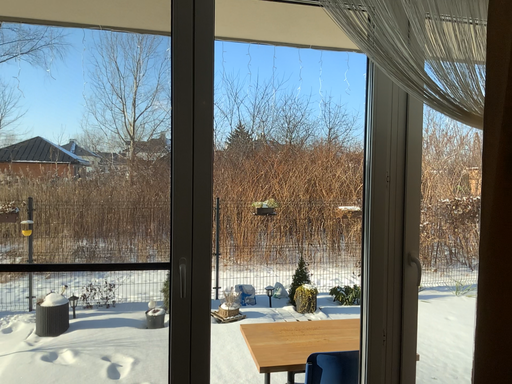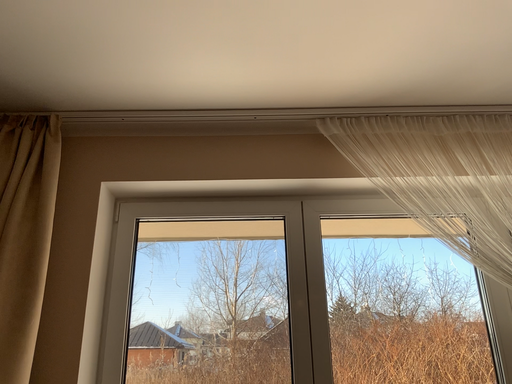
Question: Which way did the camera rotate in the video?

Choices:
 (A) rotated left
 (B) rotated right

Answer: (A)